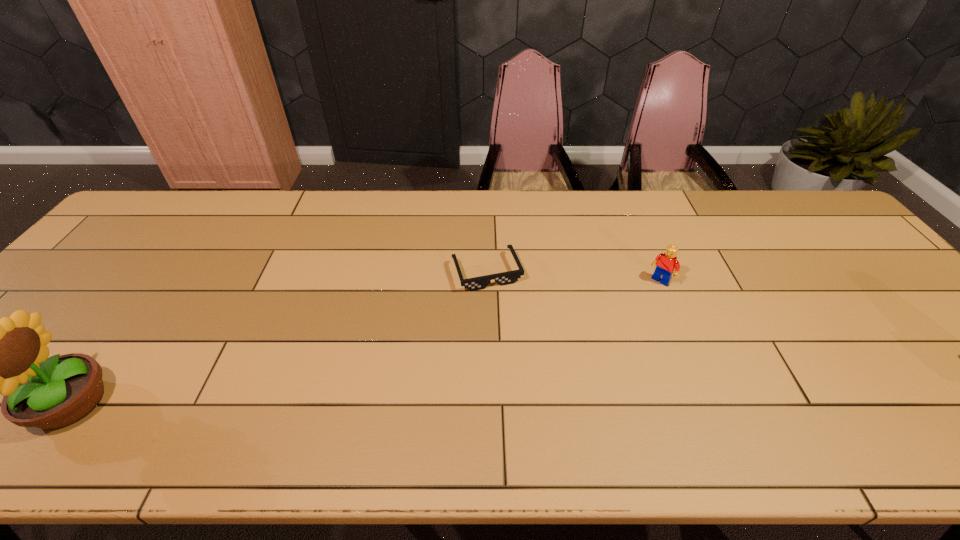
The height and width of the screenshot is (540, 960). I want to click on vacant point located between the rightmost object and the tallest object, so click(366, 341).

Locate an element on the screen. The width and height of the screenshot is (960, 540). free space between the sunglasses and the sunflower is located at coordinates (279, 337).

Where is `unoccupied position between the Lego and the tallest object`? unoccupied position between the Lego and the tallest object is located at coordinates (366, 341).

Locate which object is the second closest to the Lego. Please provide its 2D coordinates. Your answer should be formatted as a tuple, i.e. [(x, y)], where the tuple contains the x and y coordinates of a point satisfying the conditions above.

[(8, 356)]

Locate which object ranks second in proximity to the shortest object. Please provide its 2D coordinates. Your answer should be formatted as a tuple, i.e. [(x, y)], where the tuple contains the x and y coordinates of a point satisfying the conditions above.

[(8, 356)]